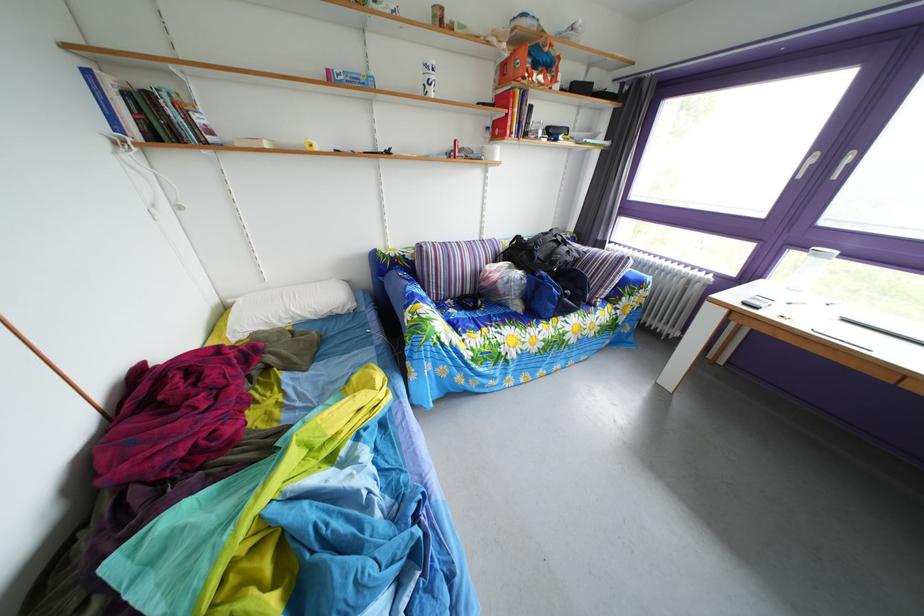
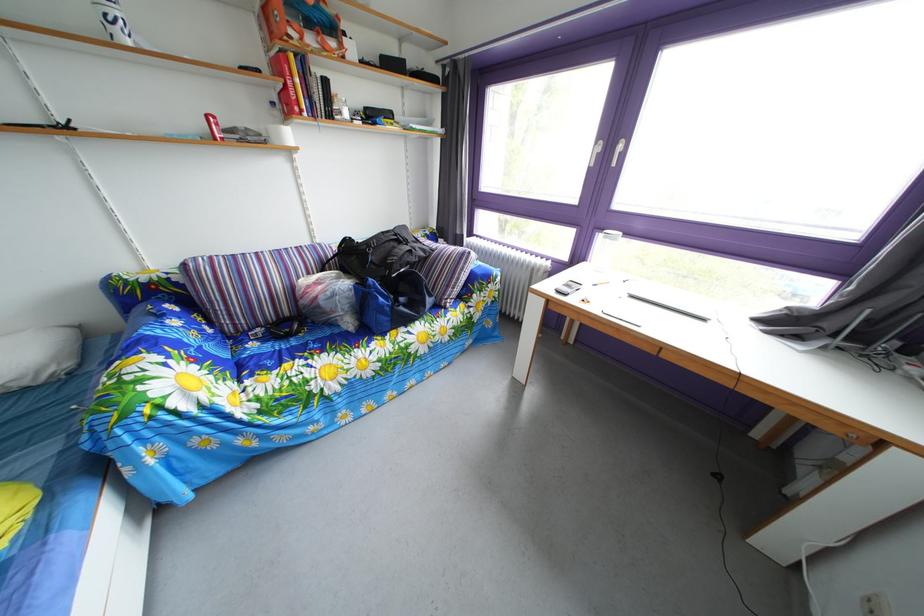
Question: The first image is from the beginning of the video and the second image is from the end. How did the camera likely rotate when shooting the video?

Choices:
 (A) Left
 (B) Right
 (C) Up
 (D) Down

Answer: (B)